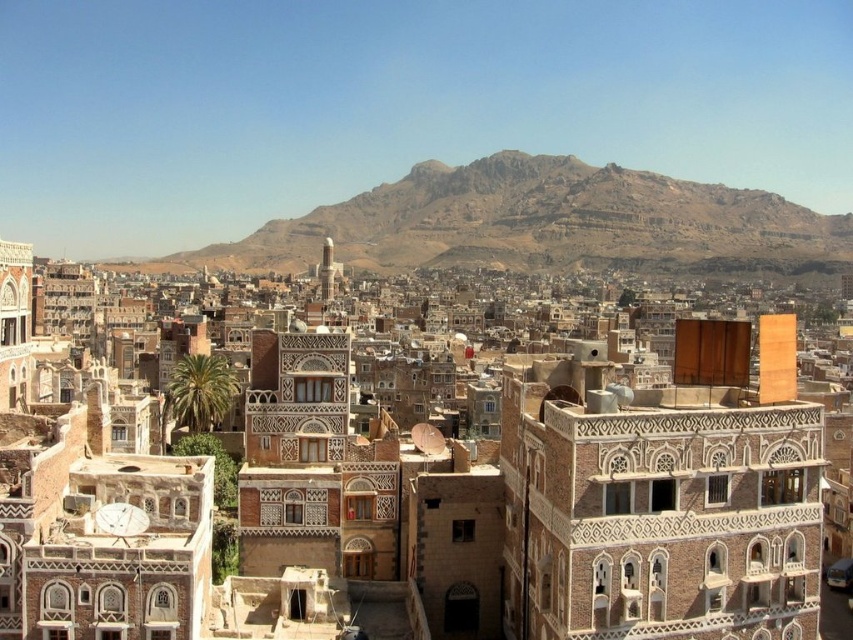
You are an architect planning to construct a new skyscraper in the city. Considering the existing structures, which of the two objects at the center, the brown textured building at center or the rugged brown rock formation at center, would you need to consider in terms of height restrictions for your design?

Answer: The rugged brown rock formation at center is taller than the brown textured building at center, so you should consider its height when planning the skyscraper to ensure compliance with local regulations and maintain visual harmony with the surrounding architecture.

You are a drone operator tasked with capturing aerial footage of the urban landscape. Your drone has a maximum flight range of 1000 feet. You need to fly from the brown textured building at center to the rugged brown rock formation at center. Can your drone complete this journey without needing to return to its base for a recharge?

The brown textured building at center is 1342.31 feet away from rugged brown rock formation at center. Since the drone can only fly up to 1000 feet before needing to recharge, it cannot complete the journey without returning to its base.

What are the coordinates of the brown textured building at center?

The coordinates of the brown textured building at center are (439, 502).